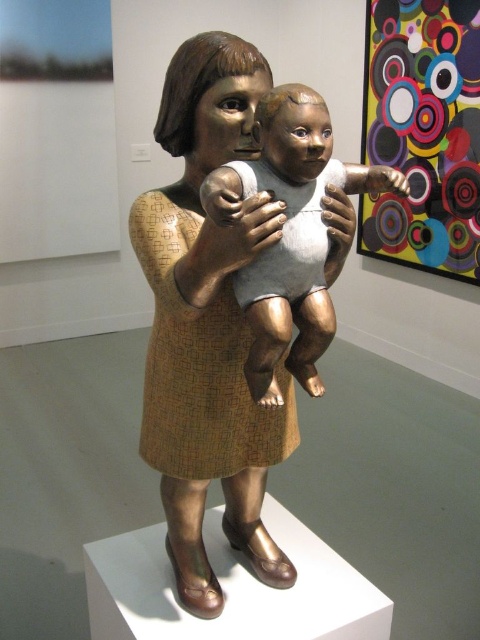
You are an art curator planning to move the bronze statue at center to the left side of the gallery. If you do so, will the statue potentially block the view of the multicolored concentric circles on canvas at upper right? Please explain your reasoning based on their sizes.

The bronze statue at center might be wider than the multicolored concentric circles on canvas at upper right. If the statue is moved to the left, its width could potentially block the view of the canvas, depending on how much it extends into the space where the canvas is located.

You are an art student analyzing the composition of this gallery piece. You notice the multicolored concentric circles on canvas at upper right and the matte white baby at center. Which object occupies a more prominent visual space in the artwork?

The multicolored concentric circles on canvas at upper right has a larger size compared to the matte white baby at center, making it occupy a more prominent visual space in the artwork.

You are standing in an art gallery and want to get a closer look at the multicolored concentric circles on canvas at upper right. If you take three steps forward, each step being 0.8 meters, will you be within 1 meter of the painting?

The multicolored concentric circles on canvas at upper right is 3.07 meters away from viewer. After taking three steps forward totaling 2.4 meters, you would be 0.67 meters away from the painting, which is within 1 meter. Yes, you will be within 1 meter of the painting.